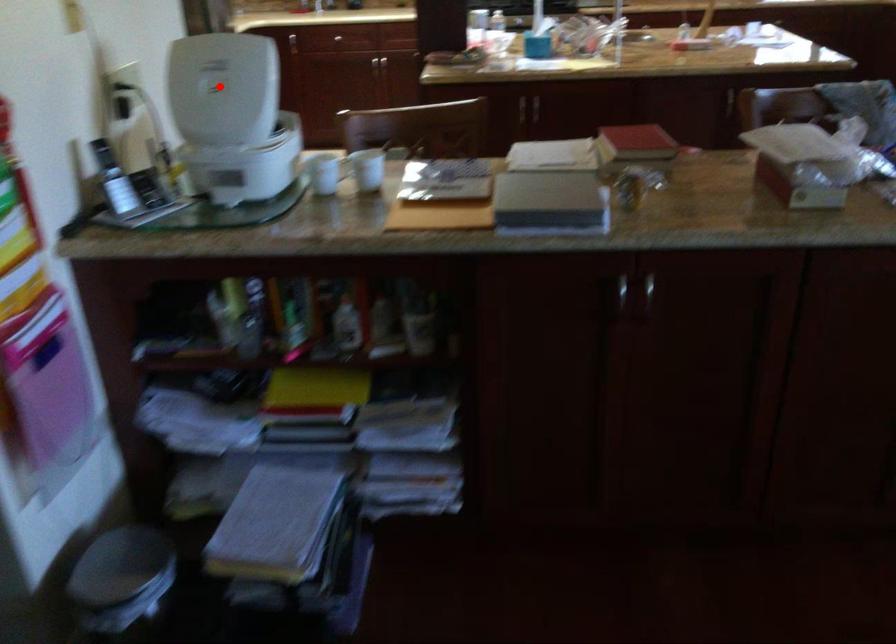
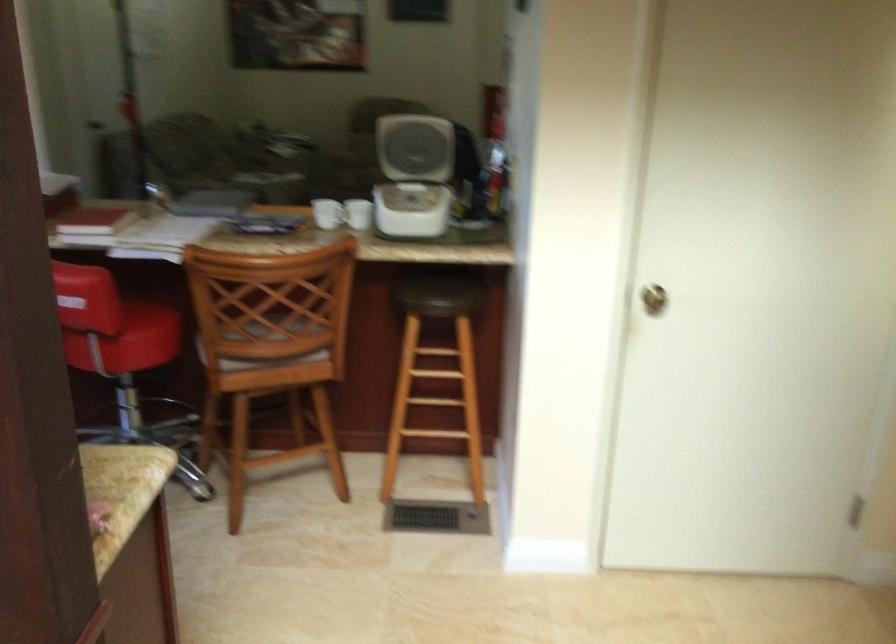
Question: A red point is marked in image1. In image2, is the corresponding 3D point closer to the camera or farther? Reply with the corresponding letter.

Choices:
 (A) The corresponding 3D point is closer.
 (B) The corresponding 3D point is farther.

Answer: (B)